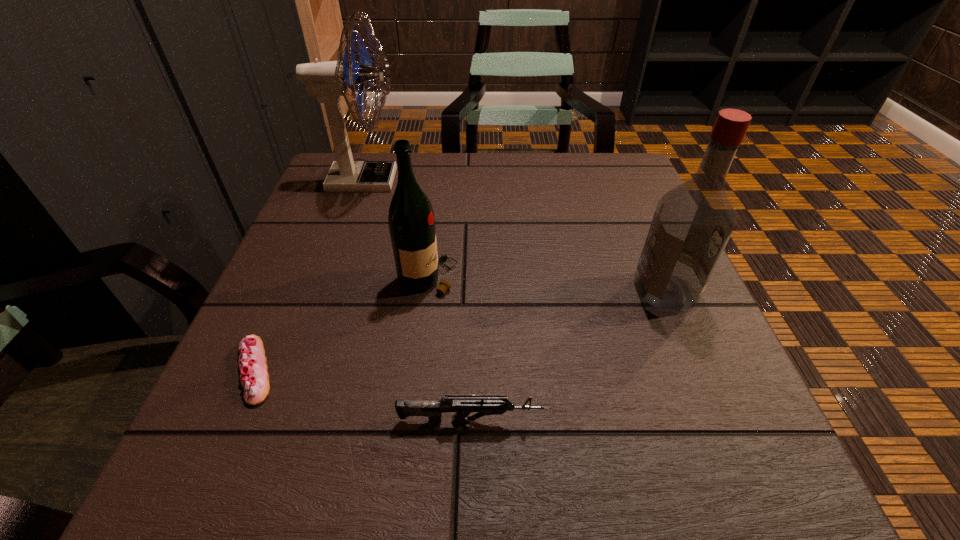
The width and height of the screenshot is (960, 540). In the image, there is a desktop. Find the location of `vacant space at the near edge`. vacant space at the near edge is located at coordinates (335, 496).

Identify the location of vacant space at the left edge of the desktop. This screenshot has width=960, height=540. (303, 215).

I want to click on blank space at the right edge of the desktop, so click(624, 301).

Find the location of a particular element. This screenshot has height=540, width=960. vacant space at the far left corner of the desktop is located at coordinates (348, 198).

Where is `vacant area that lies between the gun and the fourth farthest object`? vacant area that lies between the gun and the fourth farthest object is located at coordinates (364, 395).

Where is `vacant area that lies between the farthest object and the rightmost object`? Image resolution: width=960 pixels, height=540 pixels. vacant area that lies between the farthest object and the rightmost object is located at coordinates (515, 236).

You are a GUI agent. You are given a task and a screenshot of the screen. Output one action in this format:
    pyautogui.click(x=<x>, y=<y>)
    Task: Click on the free area in between the wine bottle and the second shortest object
    
    Given the screenshot: What is the action you would take?
    451,349

You are a GUI agent. You are given a task and a screenshot of the screen. Output one action in this format:
    pyautogui.click(x=<x>, y=<y>)
    Task: Click on the empty location between the liquor and the nearest object
    Image resolution: width=960 pixels, height=540 pixels.
    Given the screenshot: What is the action you would take?
    [x=569, y=356]

This screenshot has width=960, height=540. I want to click on vacant area between the rightmost object and the third tallest object, so click(546, 285).

The image size is (960, 540). Find the location of `free space between the fan and the rightmost object`. free space between the fan and the rightmost object is located at coordinates (515, 236).